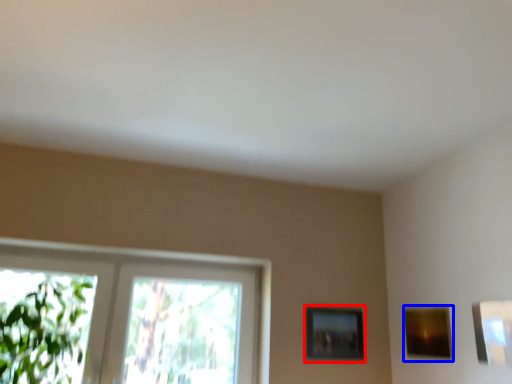
Question: Which of the following is the closest to the observer, picture frame (highlighted by a red box) or picture frame (highlighted by a blue box)?

Choices:
 (A) picture frame
 (B) picture frame

Answer: (B)